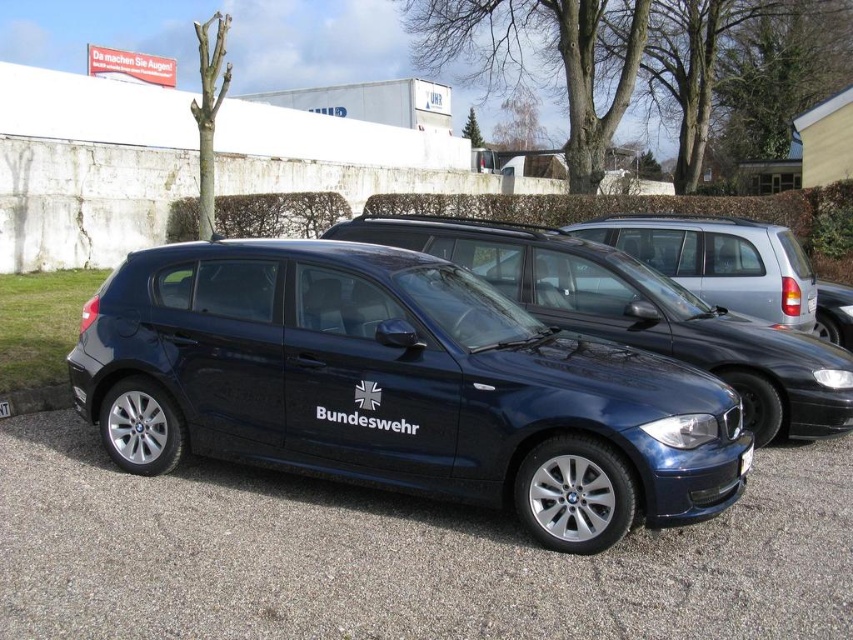
Which is more to the right, satin silver minivan at center or white plastic license plate at center?

satin silver minivan at center is more to the right.

Which is above, satin silver minivan at center or white plastic license plate at center?

Positioned higher is satin silver minivan at center.

Between point (706, 294) and point (7, 403), which one is positioned in front?

Positioned in front is point (7, 403).

Locate an element on the screen. The height and width of the screenshot is (640, 853). satin silver minivan at center is located at coordinates (718, 260).

Is point (619, 241) positioned after point (746, 472)?

Yes, it is.

Does satin silver minivan at center come behind white plastic license plate at lower right?

Yes.

Who is more forward, (651, 260) or (743, 454)?

Point (743, 454) is more forward.

Locate an element on the screen. Image resolution: width=853 pixels, height=640 pixels. satin silver minivan at center is located at coordinates pyautogui.click(x=718, y=260).

Is satin black sedan at center positioned behind satin black car at center?

No, satin black sedan at center is in front of satin black car at center.

Is satin black sedan at center smaller than satin black car at center?

Yes.

This screenshot has width=853, height=640. What do you see at coordinates (398, 387) in the screenshot?
I see `satin black sedan at center` at bounding box center [398, 387].

This screenshot has width=853, height=640. What are the coordinates of `satin black sedan at center` in the screenshot? It's located at (398, 387).